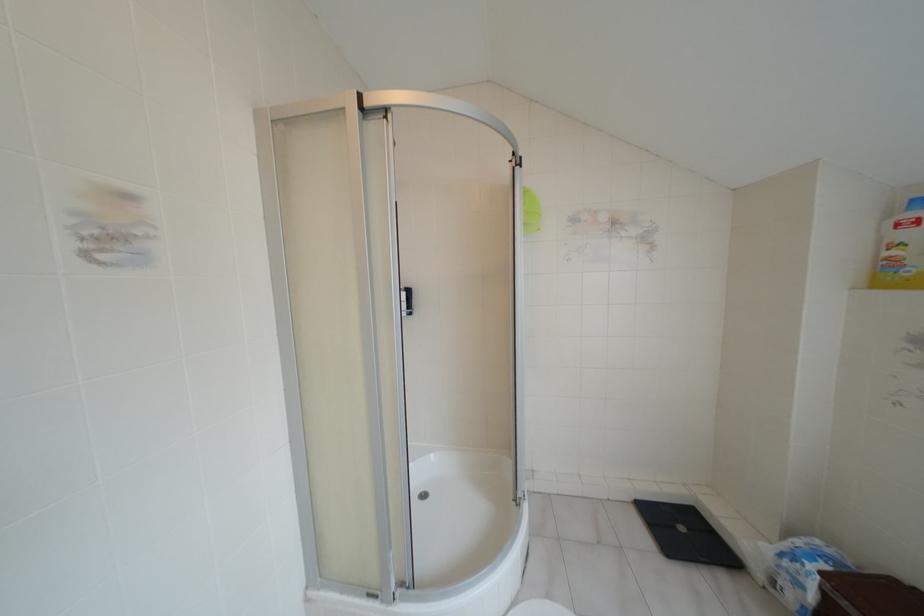
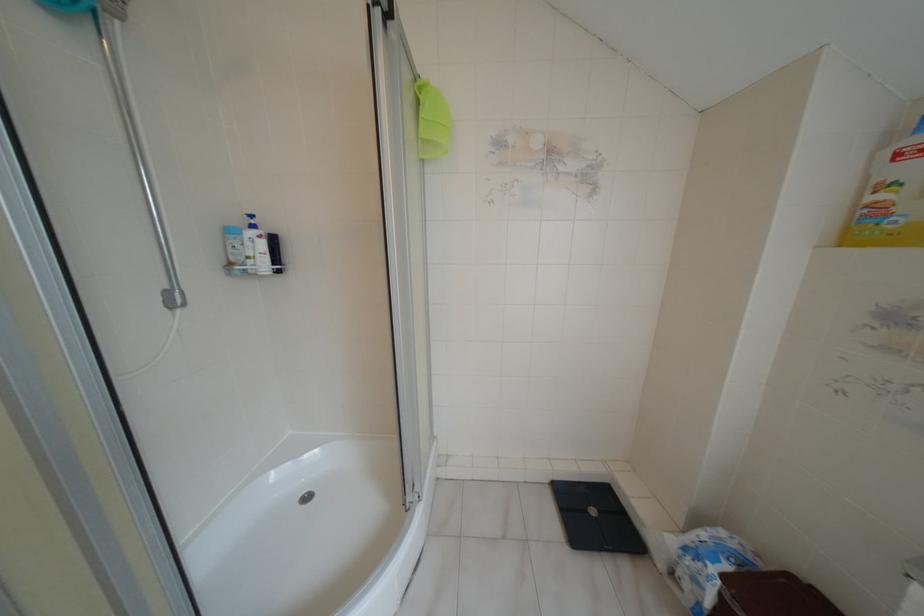
Locate, in the second image, the point that corresponds to the point at 681,528 in the first image.

(591, 511)